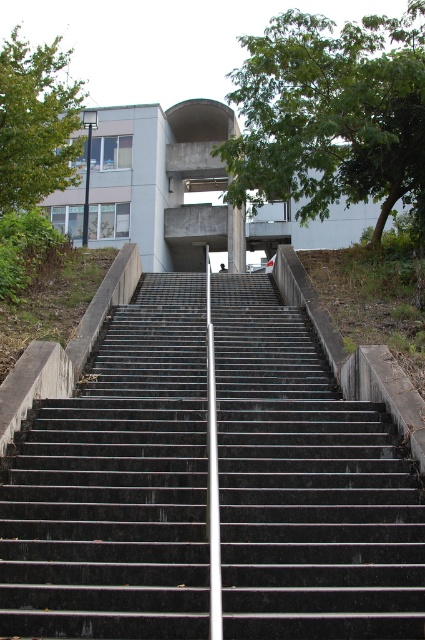
Between black concrete stairs at center and green leafy tree at upper left, which one is positioned lower?

Positioned lower is black concrete stairs at center.

Consider the image. Is black concrete stairs at center to the right of green leafy tree at upper left from the viewer's perspective?

Indeed, black concrete stairs at center is positioned on the right side of green leafy tree at upper left.

The image size is (425, 640). What do you see at coordinates (116, 484) in the screenshot? I see `black concrete stairs at center` at bounding box center [116, 484].

In order to click on black concrete stairs at center in this screenshot , I will do `click(116, 484)`.

Which is below, black concrete stairs at center or green leafy tree at upper center?

black concrete stairs at center

Who is more distant from viewer, (408, 490) or (294, 92)?

The point (294, 92) is behind.

You are a GUI agent. You are given a task and a screenshot of the screen. Output one action in this format:
    pyautogui.click(x=<x>, y=<y>)
    Task: Click on the black concrete stairs at center
    This screenshot has width=425, height=640.
    Given the screenshot: What is the action you would take?
    pyautogui.click(x=116, y=484)

Can you confirm if green leafy tree at upper center is thinner than green leafy tree at upper left?

Yes.

At what (x,y) coordinates should I click in order to perform the action: click on green leafy tree at upper center. Please return your answer as a coordinate pair (x, y). Image resolution: width=425 pixels, height=640 pixels. Looking at the image, I should click on (331, 113).

Who is more distant from viewer, [397,97] or [28,48]?

Point [28,48]

The image size is (425, 640). I want to click on green leafy tree at upper center, so click(x=331, y=113).